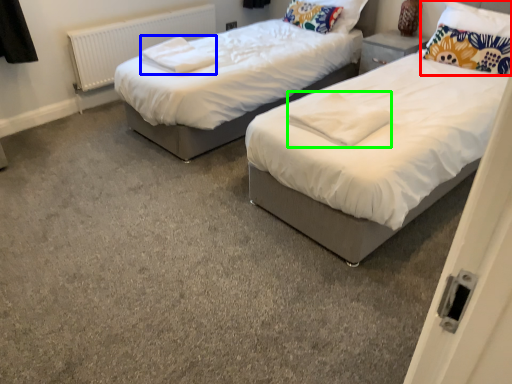
Question: Which object is positioned farthest from pillow (highlighted by a red box)? Select from linen (highlighted by a blue box) and linen (highlighted by a green box).

Choices:
 (A) linen
 (B) linen

Answer: (A)